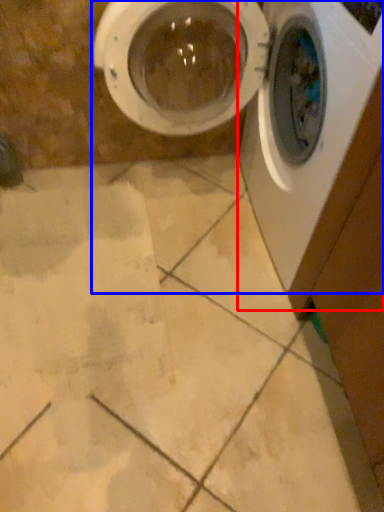
Question: Which object appears closest to the camera in this image, washing machine (highlighted by a red box) or washing machine (highlighted by a blue box)?

Choices:
 (A) washing machine
 (B) washing machine

Answer: (A)